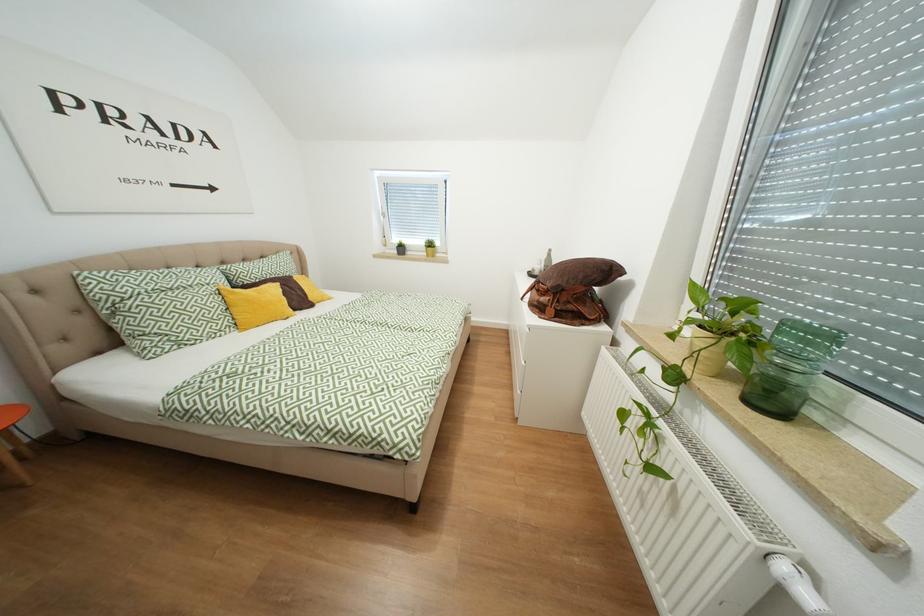
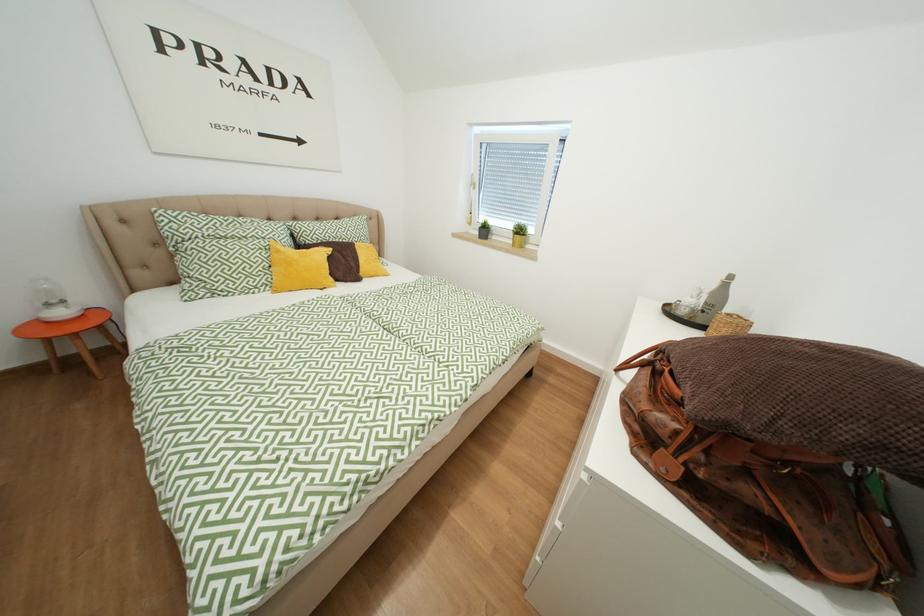
Question: The first image is from the beginning of the video and the second image is from the end. How did the camera likely rotate when shooting the video?

Choices:
 (A) Left
 (B) Right
 (C) Up
 (D) Down

Answer: (A)